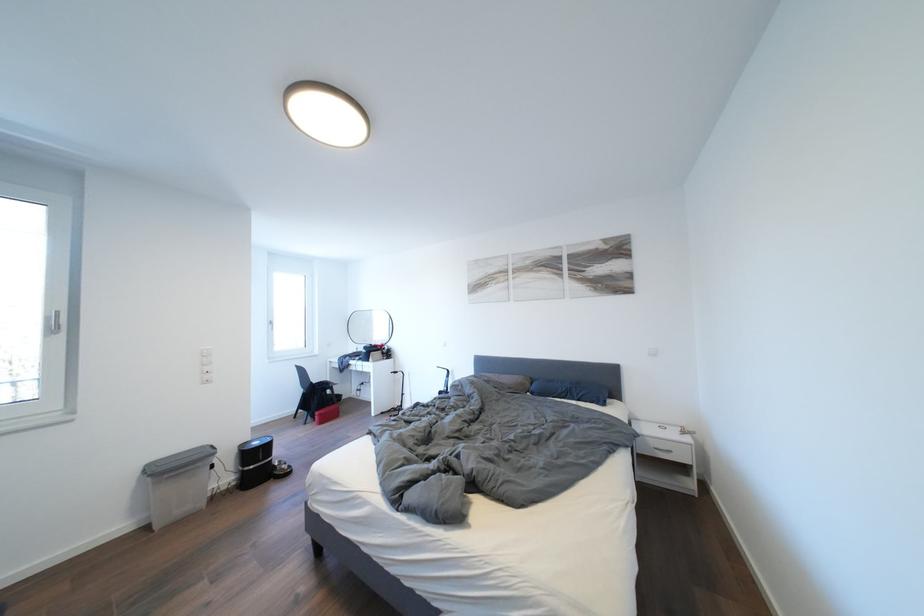
You are a GUI agent. You are given a task and a screenshot of the screen. Output one action in this format:
    pyautogui.click(x=<x>, y=<y>)
    Task: Click on the blue pillow
    The width and height of the screenshot is (924, 616).
    Given the screenshot: What is the action you would take?
    pyautogui.click(x=569, y=390)